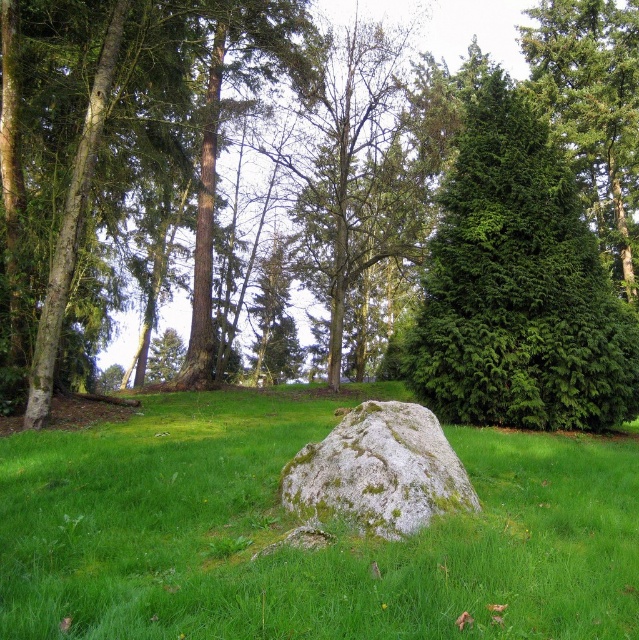
You are standing at the center of the grassy field in the image and want to walk towards the point labeled as point (594, 113). Which direction should you head to reach that point?

The point (594, 113) corresponds to the green textured evergreen tree at right, so you should head towards the right side of the image to reach it.